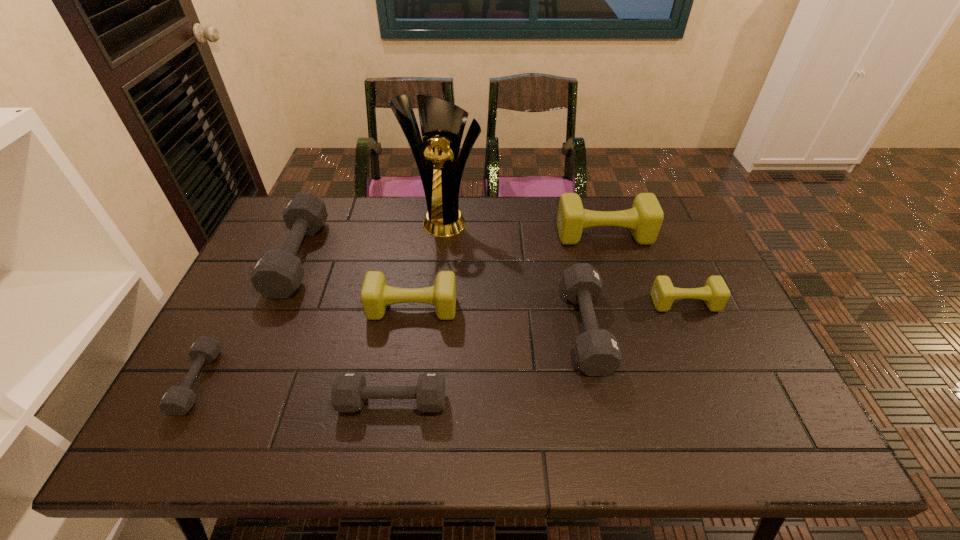
Identify the location of object that is at the far left corner. click(x=278, y=273).

At what (x,y) coordinates should I click in order to perform the action: click on object at the near left corner. Please return your answer as a coordinate pair (x, y). The image size is (960, 540). Looking at the image, I should click on (177, 400).

The image size is (960, 540). I want to click on object present at the far right corner, so click(645, 218).

Image resolution: width=960 pixels, height=540 pixels. Identify the location of vacant space at the far edge of the desktop. (372, 234).

You are a GUI agent. You are given a task and a screenshot of the screen. Output one action in this format:
    pyautogui.click(x=<x>, y=<y>)
    Task: Click on the vacant space at the near edge of the desktop
    The image size is (960, 540).
    Given the screenshot: What is the action you would take?
    click(x=303, y=448)

I want to click on vacant space at the left edge, so click(x=253, y=316).

You are a GUI agent. You are given a task and a screenshot of the screen. Output one action in this format:
    pyautogui.click(x=<x>, y=<y>)
    Task: Click on the vacant space at the right edge
    The width and height of the screenshot is (960, 540).
    Given the screenshot: What is the action you would take?
    pyautogui.click(x=698, y=300)

Locate an element on the screen. The image size is (960, 540). unoccupied area between the third gray dumbbell from left to right and the leftmost olive dumbbell is located at coordinates (402, 355).

The image size is (960, 540). Find the location of `free spot between the third gray dumbbell from left to right and the rightmost gray dumbbell`. free spot between the third gray dumbbell from left to right and the rightmost gray dumbbell is located at coordinates point(490,364).

The image size is (960, 540). I want to click on empty location between the third smallest gray dumbbell and the shortest dumbbell, so click(392, 355).